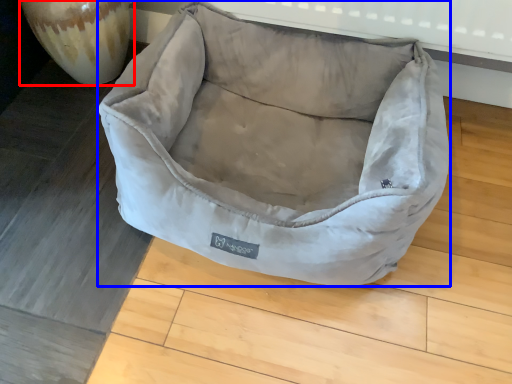
Question: Which of the following is the closest to the observer, glass vase (highlighted by a red box) or dog bed (highlighted by a blue box)?

Choices:
 (A) glass vase
 (B) dog bed

Answer: (B)